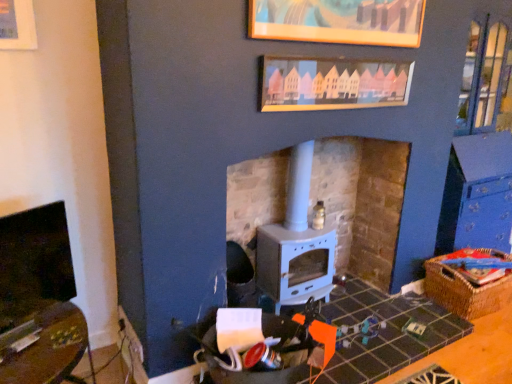
Question: Is matte black fireplace at left oriented towards wooden picture frame at upper center, which is the 1th picture frame in top-to-bottom order?

Choices:
 (A) no
 (B) yes

Answer: (A)

Question: Is matte black fireplace at left thinner than wooden picture frame at upper center, which is the 1th picture frame in top-to-bottom order?

Choices:
 (A) yes
 (B) no

Answer: (B)

Question: Is matte black fireplace at left further to camera compared to wooden picture frame at upper center, which is the 1th picture frame in top-to-bottom order?

Choices:
 (A) no
 (B) yes

Answer: (A)

Question: Can we say matte black fireplace at left lies outside wooden picture frame at upper center, which is the 1th picture frame in top-to-bottom order?

Choices:
 (A) yes
 (B) no

Answer: (A)

Question: Is wooden picture frame at upper center, the 2th picture frame from the bottom, surrounded by matte black fireplace at left?

Choices:
 (A) yes
 (B) no

Answer: (B)

Question: Are matte black fireplace at left and wooden picture frame at upper center, which is the 1th picture frame in top-to-bottom order, far apart?

Choices:
 (A) no
 (B) yes

Answer: (B)

Question: From the image's perspective, would you say wooden picture frame at upper center, which is the 1th picture frame in top-to-bottom order, is shown under matte black fireplace at left?

Choices:
 (A) no
 (B) yes

Answer: (A)

Question: Does wooden picture frame at upper center, which is the 1th picture frame in top-to-bottom order, touch matte black fireplace at left?

Choices:
 (A) yes
 (B) no

Answer: (B)

Question: Is wooden picture frame at upper center, which is the 1th picture frame in top-to-bottom order, facing away from matte black fireplace at left?

Choices:
 (A) yes
 (B) no

Answer: (B)

Question: Is wooden picture frame at upper center, the 2th picture frame from the bottom, closer to the viewer compared to matte black fireplace at left?

Choices:
 (A) yes
 (B) no

Answer: (B)

Question: Can you confirm if wooden picture frame at upper center, which is the 1th picture frame in top-to-bottom order, is shorter than matte black fireplace at left?

Choices:
 (A) yes
 (B) no

Answer: (A)

Question: Is matte black fireplace at left a part of wooden picture frame at upper center, which is the 1th picture frame in top-to-bottom order?

Choices:
 (A) no
 (B) yes

Answer: (A)

Question: Is woven brown basket at lower right shorter than white matte wood burning stove at center?

Choices:
 (A) yes
 (B) no

Answer: (A)